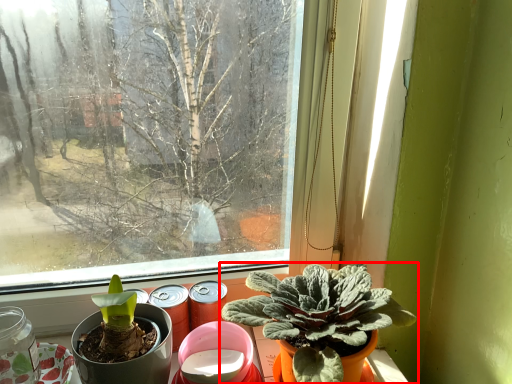
Question: From the image's perspective, where is houseplant (annotated by the red box) located in relation to glass jar in the image?

Choices:
 (A) above
 (B) below

Answer: (A)